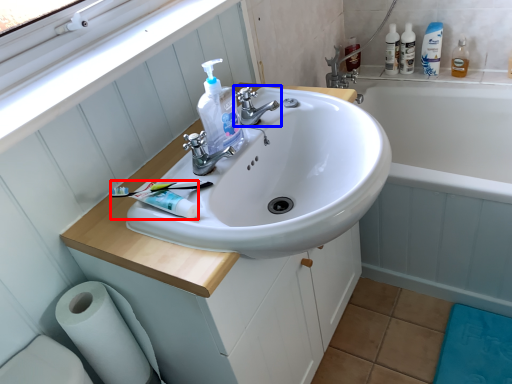
Question: Which point is closer to the camera, toothpaste (highlighted by a red box) or tap (highlighted by a blue box)?

Choices:
 (A) toothpaste
 (B) tap

Answer: (A)